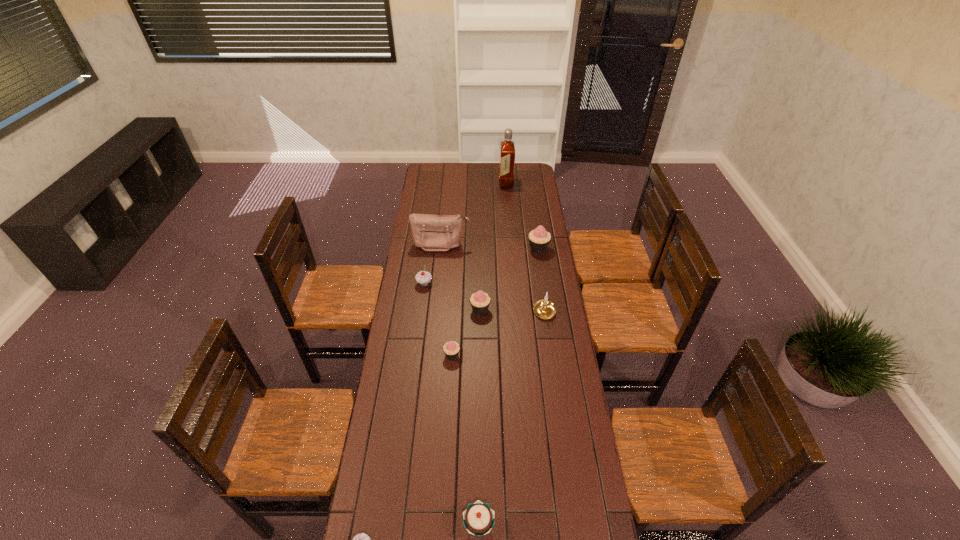
Where is `vacant area that lies between the rightmost cupcake and the candle holder`? This screenshot has width=960, height=540. vacant area that lies between the rightmost cupcake and the candle holder is located at coordinates (541, 281).

Where is `blank region between the rightmost cupcake and the second tallest object`? This screenshot has height=540, width=960. blank region between the rightmost cupcake and the second tallest object is located at coordinates (490, 247).

I want to click on free space between the third farthest cupcake and the third tallest object, so click(509, 279).

This screenshot has width=960, height=540. Find the location of `free spot between the leftmost pink cupcake and the right gray cupcake`. free spot between the leftmost pink cupcake and the right gray cupcake is located at coordinates (438, 320).

This screenshot has height=540, width=960. Identify the location of vacant space that is in between the biggest pink cupcake and the candle holder. (541, 281).

Where is `free area in between the liquor and the leftmost pink cupcake`? The height and width of the screenshot is (540, 960). free area in between the liquor and the leftmost pink cupcake is located at coordinates [x=479, y=269].

I want to click on vacant space that is in between the nearest pink cupcake and the second pink cupcake from left to right, so click(466, 333).

Find the location of a particular element. This screenshot has width=960, height=540. unoccupied area between the third tallest object and the second nearest pink cupcake is located at coordinates (509, 279).

Where is `object that is the third closest one to the tallest object`? The image size is (960, 540). object that is the third closest one to the tallest object is located at coordinates (423, 278).

At what (x,y) coordinates should I click in order to perform the action: click on object identified as the fourth closest to the candle holder. Please return your answer as a coordinate pair (x, y). This screenshot has height=540, width=960. Looking at the image, I should click on (430, 232).